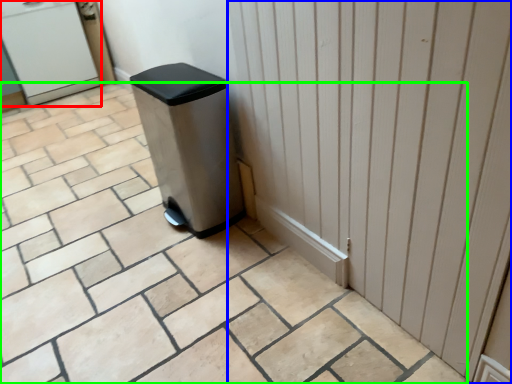
Question: Based on their relative distances, which object is nearer to water cooler (highlighted by a red box)? Choose from door (highlighted by a blue box) and ceramic tile (highlighted by a green box).

Choices:
 (A) door
 (B) ceramic tile

Answer: (B)